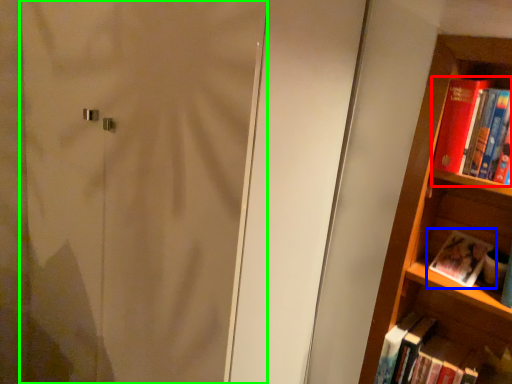
Question: Based on their relative distances, which object is nearer to book (highlighted by a red box)? Choose from book (highlighted by a blue box) and screen door (highlighted by a green box).

Choices:
 (A) book
 (B) screen door

Answer: (A)